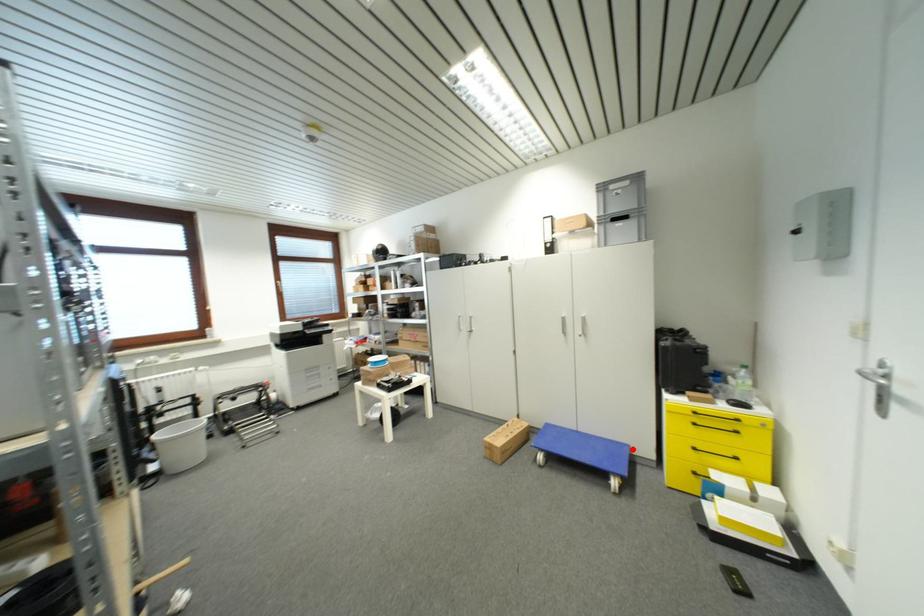
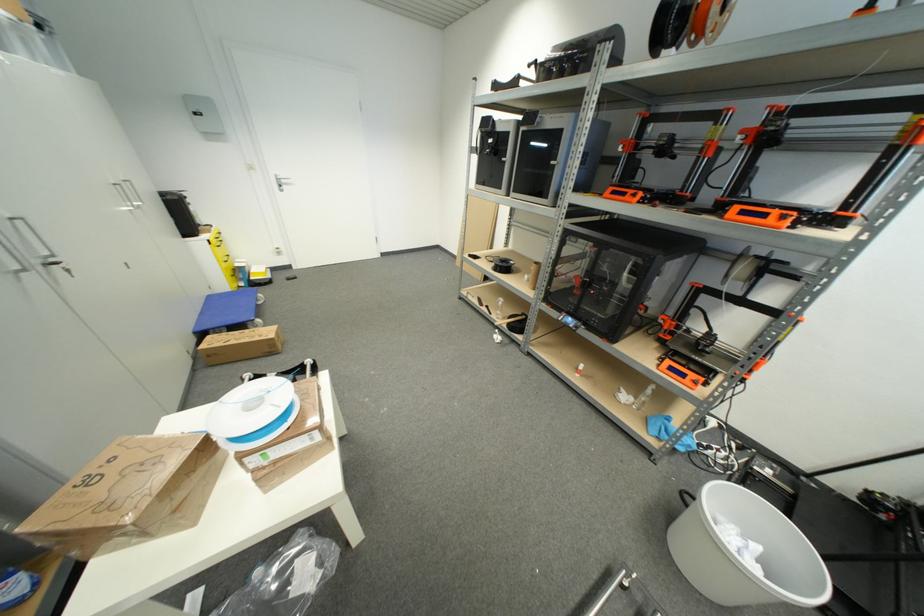
Question: A red point is marked in image1. In image2, is the corresponding 3D point closer to the camera or farther? Reply with the corresponding letter.

Choices:
 (A) The corresponding 3D point is closer.
 (B) The corresponding 3D point is farther.

Answer: (A)